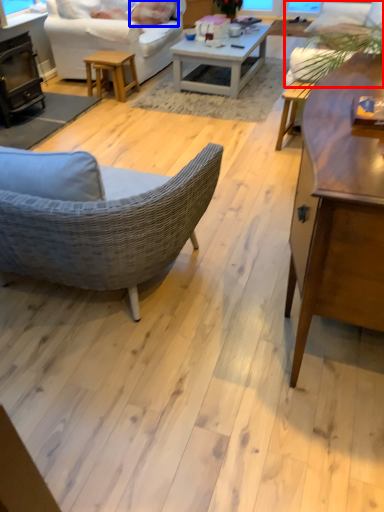
Question: Which object appears farthest to the camera in this image, couch (highlighted by a red box) or pillow (highlighted by a blue box)?

Choices:
 (A) couch
 (B) pillow

Answer: (B)